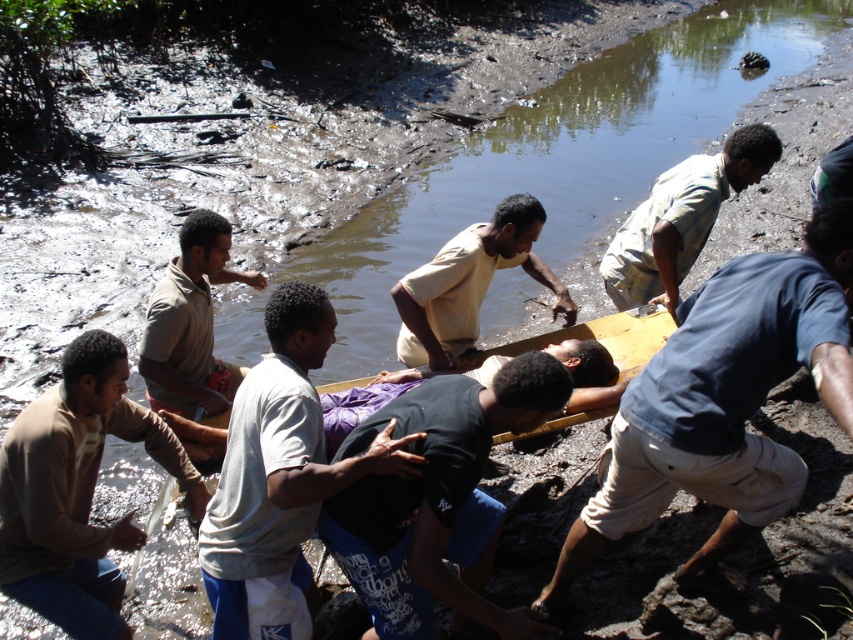
From the picture: You are a photographer trying to capture a clear photo of both the light beige shirt at center and the matte beige shirt at left. Since you want to ensure both are visible, which shirt should you focus on first to avoid blurring due to their size difference?

The light beige shirt at center is larger in size than the matte beige shirt at left, so you should focus on the light beige shirt at center first to ensure it is in clear focus before adjusting for the smaller matte beige shirt at left.

You are a photographer trying to capture a clear photo of the rescue operation. You notice two people in the crowd wearing a blue cotton shirt at right and a light beige shirt at center. Which person should you focus on to ensure the subject fills the frame better?

The blue cotton shirt at right is bigger than the light beige shirt at center, so focusing on the person wearing the blue cotton shirt at right would fill the frame better.